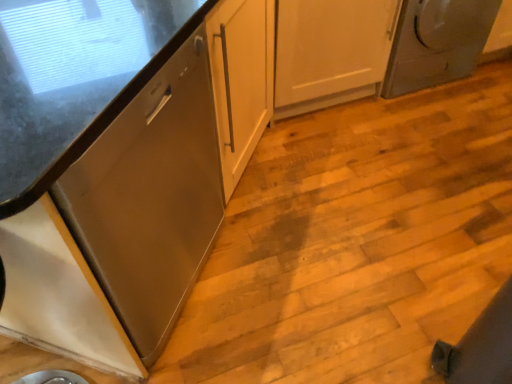
Question: From their relative heights in the image, would you say satin wood cabinet at left, the 1th cabinetry positioned from the top, is taller or shorter than white glossy cabinet at lower left, arranged as the second cabinetry when viewed from the top?

Choices:
 (A) tall
 (B) short

Answer: (A)

Question: From the image's perspective, relative to white glossy cabinet at lower left, arranged as the second cabinetry when viewed from the top, is satin wood cabinet at left, the 1th cabinetry positioned from the top, above or below?

Choices:
 (A) below
 (B) above

Answer: (B)

Question: Which object is positioned farthest from the white glossy cabinet at lower left, the first cabinetry in the bottom-to-top sequence?

Choices:
 (A) satin wood cabinet at left, the 1th cabinetry positioned from the top
 (B) satin silver dryer at upper right

Answer: (B)

Question: Which object is positioned farthest from the satin silver dryer at upper right?

Choices:
 (A) white glossy cabinet at lower left, arranged as the second cabinetry when viewed from the top
 (B) satin wood cabinet at left, positioned as the 2th cabinetry in bottom-to-top order

Answer: (A)